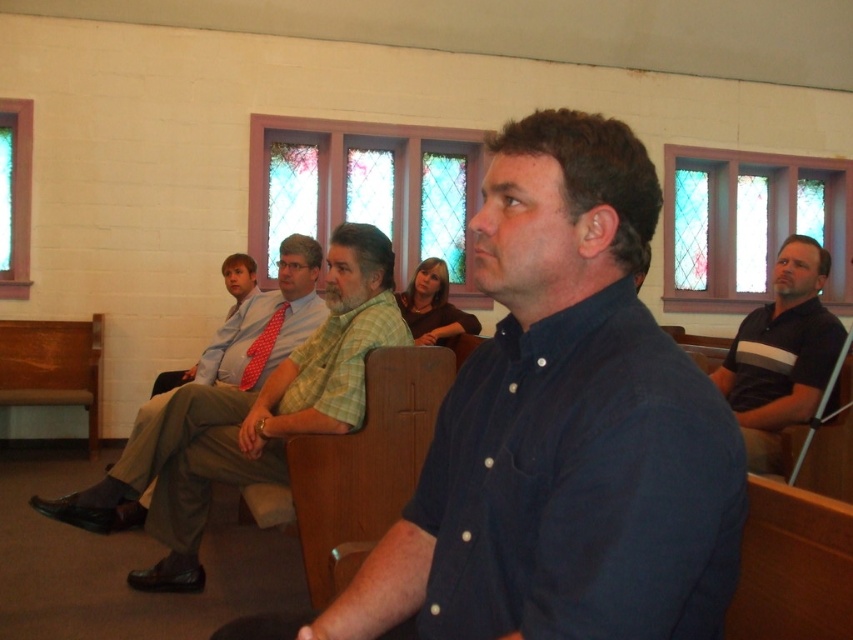
You are standing at the back of the church and want to hand a note to the person wearing the light blue shirt at center and the matte red tie at center. Which one should you target first based on their positions?

The light blue shirt at center is closer to the viewer than the matte red tie at center, so you should target the light blue shirt at center first.